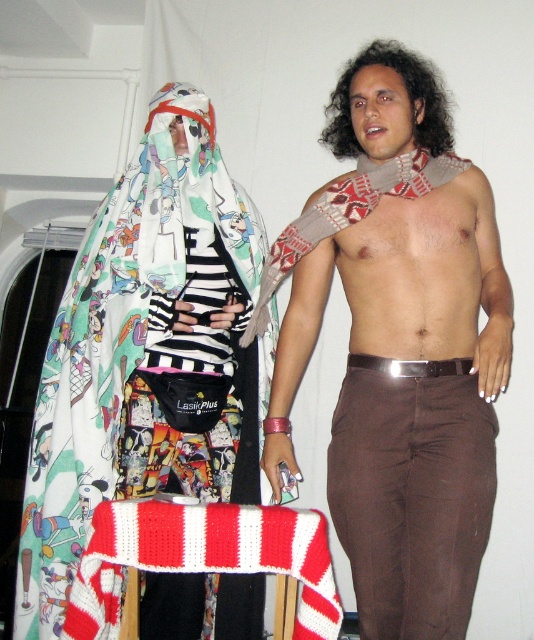
Question: Which point is farther to the camera?

Choices:
 (A) knitted red and white scarf at left
 (B) knitted red and white scarf at center

Answer: (A)

Question: Can you confirm if knitted red and white scarf at left is thinner than skinny brown muscle at center?

Choices:
 (A) no
 (B) yes

Answer: (A)

Question: From the image, what is the correct spatial relationship of brown cotton pants at center in relation to knitted red and white scarf at center?

Choices:
 (A) below
 (B) above

Answer: (B)

Question: Which object appears farthest from the camera in this image?

Choices:
 (A) brown cotton pants at center
 (B) knitted red and white scarf at center
 (C) skinny brown muscle at center

Answer: (C)

Question: Estimate the real-world distances between objects in this image. Which object is farther from the knitted red and white scarf at center?

Choices:
 (A) knitted red and white scarf at left
 (B) brown cotton pants at center
 (C) skinny brown muscle at center

Answer: (C)

Question: Is brown cotton pants at center thinner than knitted red and white scarf at left?

Choices:
 (A) yes
 (B) no

Answer: (A)